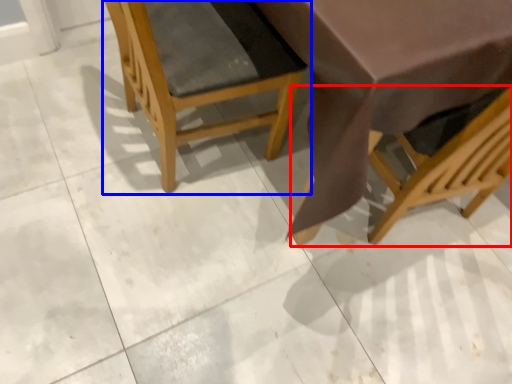
Question: Which object is further to the camera taking this photo, chair (highlighted by a red box) or chair (highlighted by a blue box)?

Choices:
 (A) chair
 (B) chair

Answer: (B)